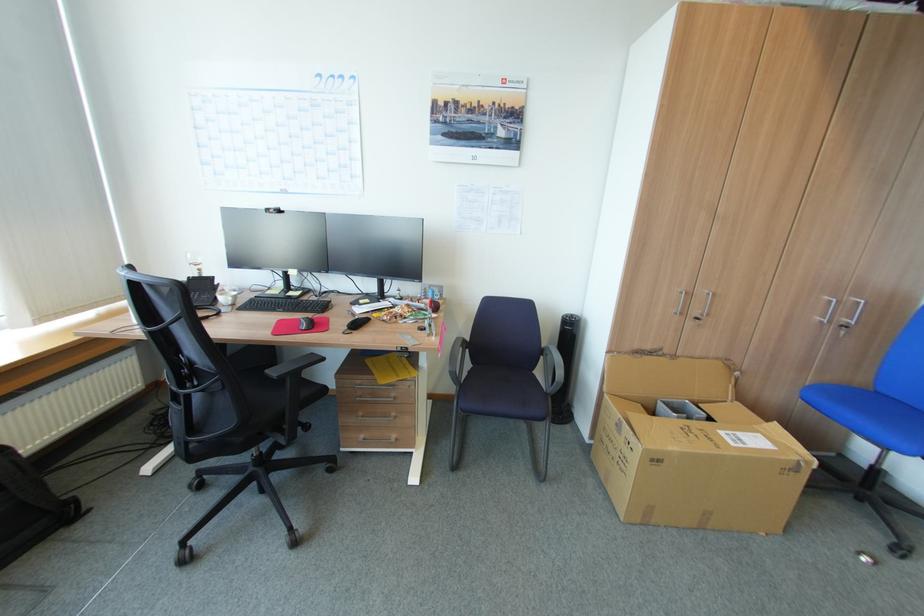
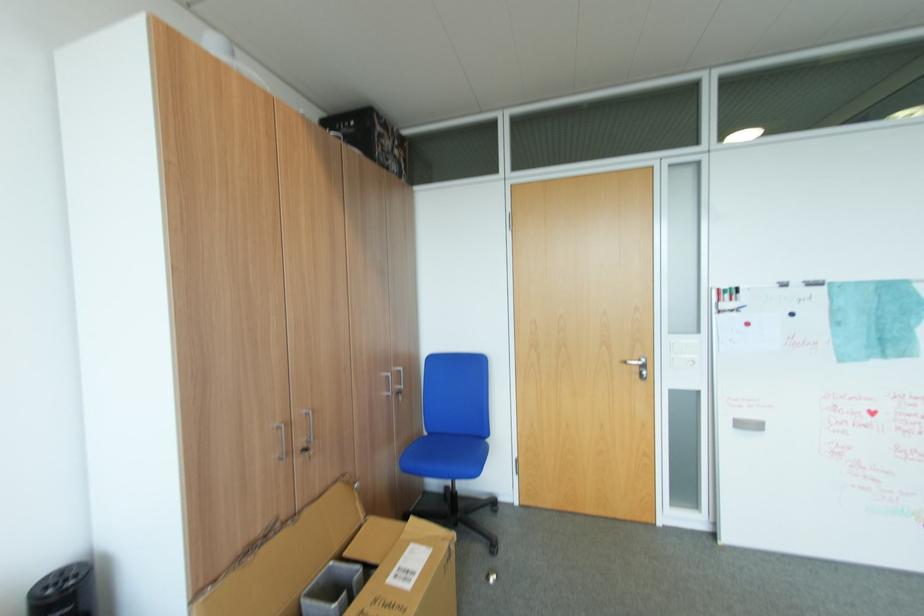
Question: The camera is either moving clockwise (left) or counter-clockwise (right) around the object. The first image is from the beginning of the video and the second image is from the end. Is the camera moving left or right when shooting the video?

Choices:
 (A) Left
 (B) Right

Answer: (A)